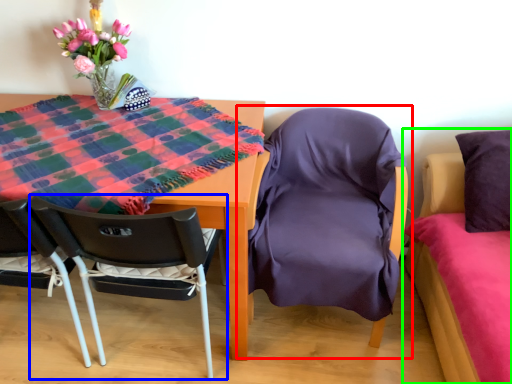
Question: Considering the real-world distances, which object is closest to chair (highlighted by a red box)? chair (highlighted by a blue box) or bed (highlighted by a green box).

Choices:
 (A) chair
 (B) bed

Answer: (B)